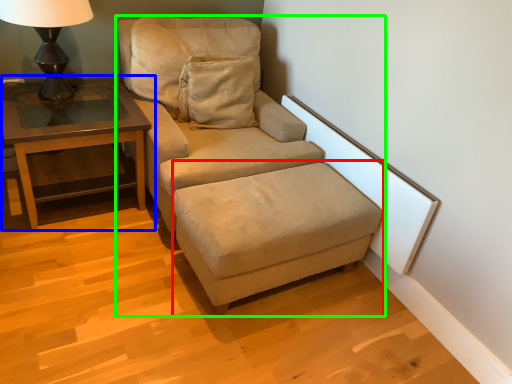
Question: Based on their relative distances, which object is nearer to footrest (highlighted by a red box)? Choose from table (highlighted by a blue box) and studio couch (highlighted by a green box).

Choices:
 (A) table
 (B) studio couch

Answer: (B)